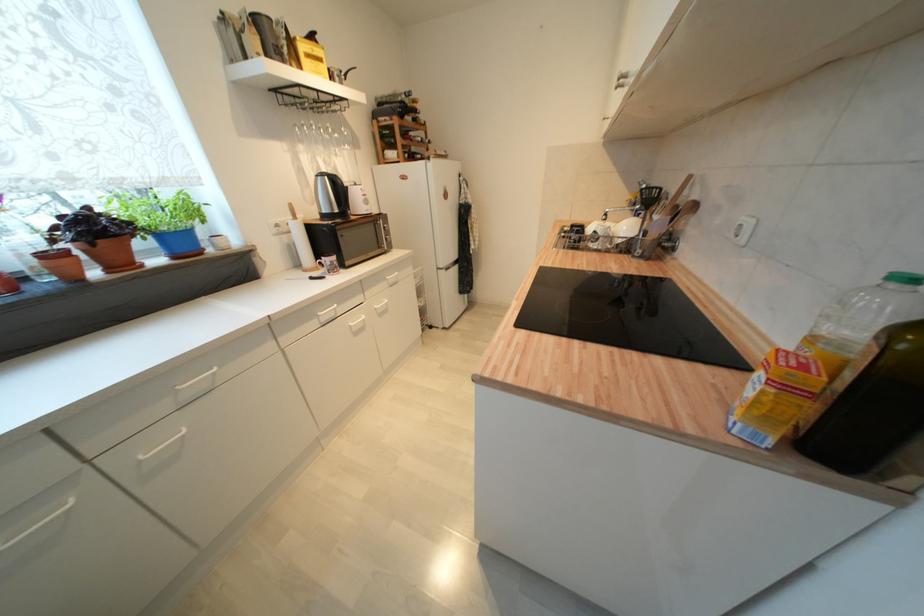
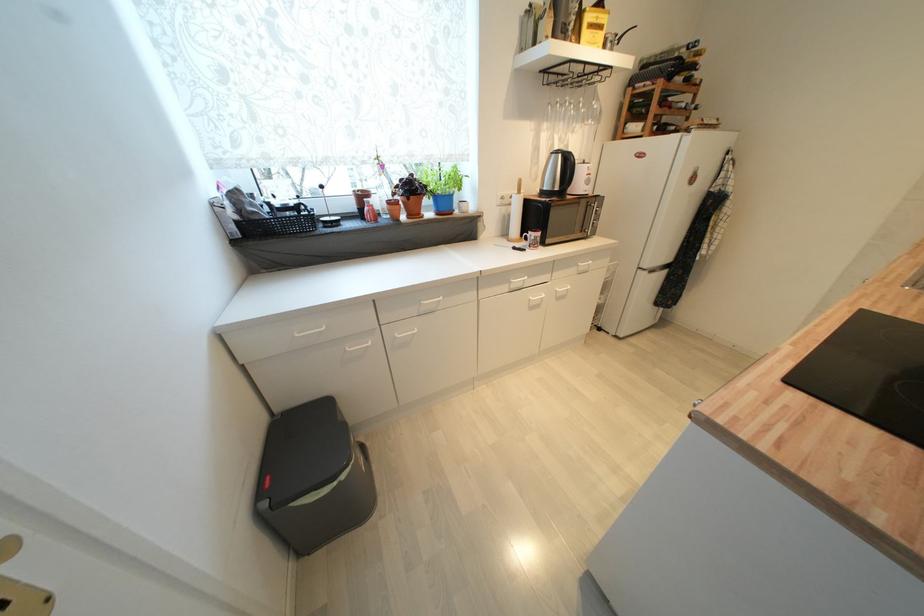
In the second image, find the point that corresponds to point 315,54 in the first image.

(600, 23)